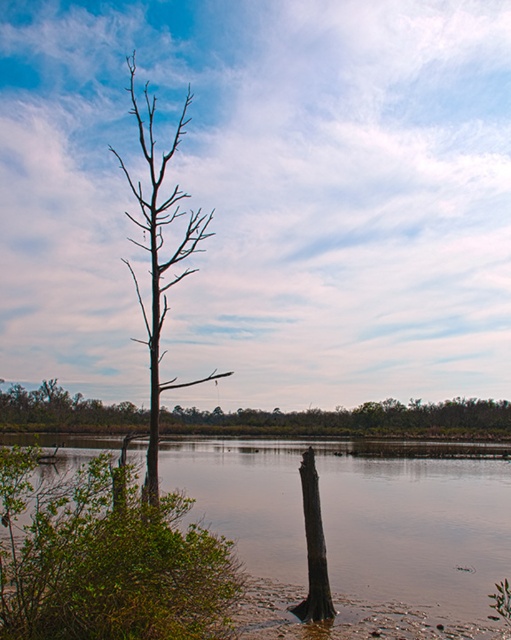
Is brown matte tree at center shorter than brown rough tree trunk at center?

Incorrect, brown matte tree at center's height does not fall short of brown rough tree trunk at center's.

Which is below, brown matte tree at center or brown rough tree trunk at center?

brown rough tree trunk at center is below.

Which is behind, point (149, 118) or point (313, 564)?

The point (313, 564) is more distant.

This screenshot has height=640, width=511. I want to click on brown matte tree at center, so click(x=159, y=260).

Based on the photo, who is lower down, brown wood tree at center or brown matte tree at center?

brown wood tree at center is below.

Who is more forward, (498, 435) or (144, 205)?

Positioned in front is point (144, 205).

Is point (134, 410) more distant than point (149, 131)?

Yes.

You are a GUI agent. You are given a task and a screenshot of the screen. Output one action in this format:
    pyautogui.click(x=<x>, y=<y>)
    Task: Click on the brown wood tree at center
    
    Given the screenshot: What is the action you would take?
    pyautogui.click(x=353, y=419)

Is brown wood tree at center further to camera compared to brown rough tree trunk at center?

Yes, brown wood tree at center is further from the viewer.

Who is more forward, (35,429) or (314,515)?

Point (314,515)

Locate an element on the screen. This screenshot has width=511, height=640. brown wood tree at center is located at coordinates (353, 419).